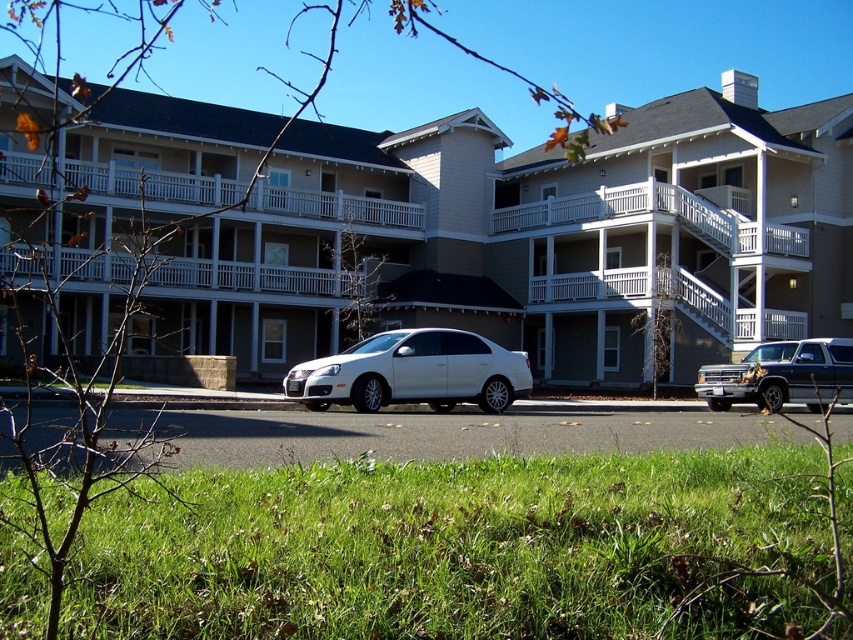
Who is positioned more to the right, white matte building at center or white metallic sedan at center?

white matte building at center is more to the right.

Is point (517, 292) more distant than point (302, 378)?

Yes, it is behind point (302, 378).

Find the location of `white matte building at center`. white matte building at center is located at coordinates (540, 237).

Who is higher up, white matte building at center or metallic silver truck at right?

Positioned higher is white matte building at center.

Can you confirm if white matte building at center is taller than metallic silver truck at right?

Correct, white matte building at center is much taller as metallic silver truck at right.

Is point (761, 138) farther from camera compared to point (842, 371)?

Yes, it is behind point (842, 371).

Image resolution: width=853 pixels, height=640 pixels. What are the coordinates of `white matte building at center` in the screenshot? It's located at click(x=540, y=237).

Is white metallic sedan at center to the right of metallic silver truck at right from the viewer's perspective?

Incorrect, white metallic sedan at center is not on the right side of metallic silver truck at right.

Can you confirm if white metallic sedan at center is positioned above metallic silver truck at right?

Answer: Yes.

Does point (495, 346) come farther from viewer compared to point (733, 403)?

That is False.

In order to click on white metallic sedan at center in this screenshot , I will do `click(413, 372)`.